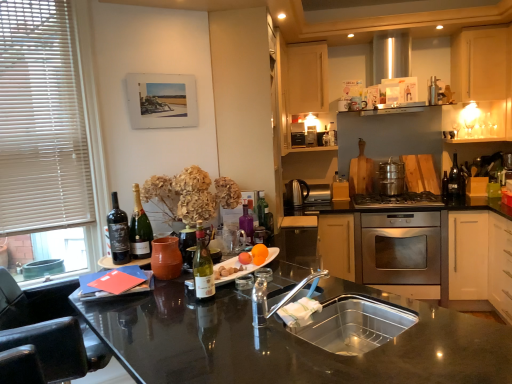
What is the approximate height of black glossy countertop at center?

The height of black glossy countertop at center is 58.65 centimeters.

Describe the element at coordinates (50, 138) in the screenshot. This screenshot has height=384, width=512. I see `white blinds at left` at that location.

Where is `white blinds at left`? white blinds at left is located at coordinates (50, 138).

The width and height of the screenshot is (512, 384). In order to click on stainless steel oven at right in this screenshot , I will do `click(401, 248)`.

The height and width of the screenshot is (384, 512). What do you see at coordinates (247, 223) in the screenshot?
I see `matte glass wine at center, acting as the 2th bottle starting from the right` at bounding box center [247, 223].

What do you see at coordinates (262, 210) in the screenshot? I see `green glass bottle at center, acting as the third bottle starting from the left` at bounding box center [262, 210].

Where is `green glass bottle at center, the third bottle in the back-to-front sequence`? This screenshot has height=384, width=512. green glass bottle at center, the third bottle in the back-to-front sequence is located at coordinates [x=202, y=266].

Does green glass bottle at center, the third bottle in the back-to-front sequence, turn towards stainless steel pot at center?

No, green glass bottle at center, the third bottle in the back-to-front sequence, is not turned towards stainless steel pot at center.

Does green glass bottle at center, the third bottle in the back-to-front sequence, appear on the right side of stainless steel pot at center?

No, green glass bottle at center, the third bottle in the back-to-front sequence, is not to the right of stainless steel pot at center.

Considering their positions, is green glass bottle at center, marked as the 1th bottle in a front-to-back arrangement, located in front of or behind stainless steel pot at center?

Clearly, green glass bottle at center, marked as the 1th bottle in a front-to-back arrangement, is in front of stainless steel pot at center.

In the scene shown: Visually, is white blinds at left positioned to the left or to the right of matte gold champagne bottle at left, which appears as the 2th wine when viewed from the left?

white blinds at left is to the left of matte gold champagne bottle at left, which appears as the 2th wine when viewed from the left.

From a real-world perspective, does white blinds at left sit lower than matte gold champagne bottle at left, the first wine when ordered from right to left?

No.

Is white blinds at left in front of matte gold champagne bottle at left, which appears as the 2th wine when viewed from the left?

Yes, it is.

Based on their sizes in the image, would you say white blinds at left is bigger or smaller than matte gold champagne bottle at left, the first wine when ordered from right to left?

Clearly, white blinds at left is larger in size than matte gold champagne bottle at left, the first wine when ordered from right to left.

Based on the photo, could you tell me if stainless steel sink at center is turned towards matte glass wine at left, which is counted as the second wine, starting from the right?

No, stainless steel sink at center is not aimed at matte glass wine at left, which is counted as the second wine, starting from the right.

This screenshot has height=384, width=512. What are the coordinates of `sink below the matte glass wine at left, which is counted as the second wine, starting from the right (from a real-world perspective)` in the screenshot? It's located at (353, 324).

Which of these two, stainless steel sink at center or matte glass wine at left, which is counted as the second wine, starting from the right, stands taller?

With more height is matte glass wine at left, which is counted as the second wine, starting from the right.

Looking at the image, does stainless steel sink at center seem bigger or smaller compared to matte glass wine at left, positioned as the first wine in left-to-right order?

In the image, stainless steel sink at center appears to be larger than matte glass wine at left, positioned as the first wine in left-to-right order.

Is stainless steel oven at right to the left of satin nickel kettle at center, which is counted as the 2th appliance, starting from the right, from the viewer's perspective?

No.

Could you tell me if stainless steel oven at right is facing satin nickel kettle at center, marked as the 2th appliance in a back-to-front arrangement?

No.

Is stainless steel oven at right situated inside satin nickel kettle at center, the second appliance positioned from the front, or outside?

stainless steel oven at right is not inside satin nickel kettle at center, the second appliance positioned from the front, it's outside.

Can you tell me how much stainless steel oven at right and satin nickel kettle at center, marked as the 2th appliance in a back-to-front arrangement, differ in facing direction?

The angle between the facing direction of stainless steel oven at right and the facing direction of satin nickel kettle at center, marked as the 2th appliance in a back-to-front arrangement, is 1.42 degrees.

Which of these two, matte ceramic vase at center, the third appliance when ordered from right to left, or stainless steel gas stove at center, is smaller?

matte ceramic vase at center, the third appliance when ordered from right to left.

Are matte ceramic vase at center, which ranks as the first appliance in front-to-back order, and stainless steel gas stove at center far apart?

matte ceramic vase at center, which ranks as the first appliance in front-to-back order, is far away from stainless steel gas stove at center.

Is matte ceramic vase at center, the third appliance when ordered from right to left, turned away from stainless steel gas stove at center?

No, matte ceramic vase at center, the third appliance when ordered from right to left, is not facing away from stainless steel gas stove at center.

Which of these two, matte glass wine at left, positioned as the first wine in left-to-right order, or satin silver toaster at center, the 1th appliance when ordered from right to left, is thinner?

matte glass wine at left, positioned as the first wine in left-to-right order.

Is matte glass wine at left, which is counted as the second wine, starting from the right, with satin silver toaster at center, which is counted as the third appliance, starting from the front?

matte glass wine at left, which is counted as the second wine, starting from the right, and satin silver toaster at center, which is counted as the third appliance, starting from the front, are not in contact.

Based on the photo, from the image's perspective, does light wood cabinet at upper center, the 2th cabinetry from the right, appear higher than matte glass wine at center, arranged as the second bottle when viewed from the back?

Indeed, from the image's perspective, light wood cabinet at upper center, the 2th cabinetry from the right, is shown above matte glass wine at center, arranged as the second bottle when viewed from the back.

From the matte glass wine at center, arranged as the second bottle when viewed from the front, count 2nd cabinetrys backward and point to it. Please provide its 2D coordinates.

[(307, 77)]

Is light wood cabinet at upper center, the 2th cabinetry from the right, facing towards matte glass wine at center, acting as the 2th bottle starting from the right?

No.

Is light wood cabinet at upper center, the 2th cabinetry from the right, next to matte glass wine at center, the second bottle in the left-to-right sequence?

light wood cabinet at upper center, the 2th cabinetry from the right, is not next to matte glass wine at center, the second bottle in the left-to-right sequence, and they're not touching.

From a real-world perspective, count 3rd bottles upward from the stainless steel pot at center and point to it. Please provide its 2D coordinates.

[(202, 266)]

The width and height of the screenshot is (512, 384). I want to click on wine that is the 2nd object located behind the white blinds at left, so click(x=140, y=229).

From the image, which object appears to be farther from black glossy countertop at center, white matte cabinet at upper right, which is the 1th cabinetry in right-to-left order, or matte gold champagne bottle at left, the first wine when ordered from right to left?

The object further to black glossy countertop at center is white matte cabinet at upper right, which is the 1th cabinetry in right-to-left order.

Considering their positions, is satin silver toaster at center, which is the third appliance from left to right, positioned further to stainless steel sink at center than stainless steel oven at right?

satin silver toaster at center, which is the third appliance from left to right.

Based on their spatial positions, is white matte cabinet at upper right, which is the second cabinetry in left-to-right order, or white blinds at left further from stainless steel oven at right?

Among the two, white blinds at left is located further to stainless steel oven at right.

When comparing their distances from stainless steel oven at right, does green glass bottle at center, the third bottle in the back-to-front sequence, or green glass wine bottle at right seem closer?

green glass wine bottle at right is positioned closer to the anchor stainless steel oven at right.

Based on their spatial positions, is matte glass wine at left, which is counted as the second wine, starting from the right, or black leather swivel chair at left closer to stainless steel oven at right?

matte glass wine at left, which is counted as the second wine, starting from the right, lies closer to stainless steel oven at right than the other object.

Which object lies nearer to the anchor point white blinds at left, green glass bottle at center, positioned as the first bottle in right-to-left order, or satin nickel kettle at center, marked as the 2th appliance in a back-to-front arrangement?

green glass bottle at center, positioned as the first bottle in right-to-left order, is closer to white blinds at left.

Considering their positions, is matte ceramic vase at center, the third appliance when ordered from right to left, positioned closer to white blinds at left than green glass wine bottle at right?

The object closer to white blinds at left is matte ceramic vase at center, the third appliance when ordered from right to left.

From the image, which object appears to be nearer to white blinds at left, satin nickel kettle at center, the second appliance positioned from the front, or green glass wine bottle at right?

satin nickel kettle at center, the second appliance positioned from the front.

This screenshot has width=512, height=384. I want to click on window between stainless steel sink at center and stainless steel pot at center along the z-axis, so click(50, 138).

Locate an element on the screen. kitchen appliance located between light wood cabinet at upper center, which is the first cabinetry from left to right, and white matte cabinet at upper right, which is the second cabinetry in left-to-right order, in the left-right direction is located at coordinates (391, 178).

Locate an element on the screen. oven between matte glass wine at center, the second bottle in the left-to-right sequence, and satin silver toaster at center, which is counted as the third appliance, starting from the front, in the front-back direction is located at coordinates (401, 248).

Image resolution: width=512 pixels, height=384 pixels. What are the coordinates of `sink between black glossy countertop at center and green glass bottle at center, the third bottle in the back-to-front sequence, in the front-back direction` in the screenshot? It's located at [353, 324].